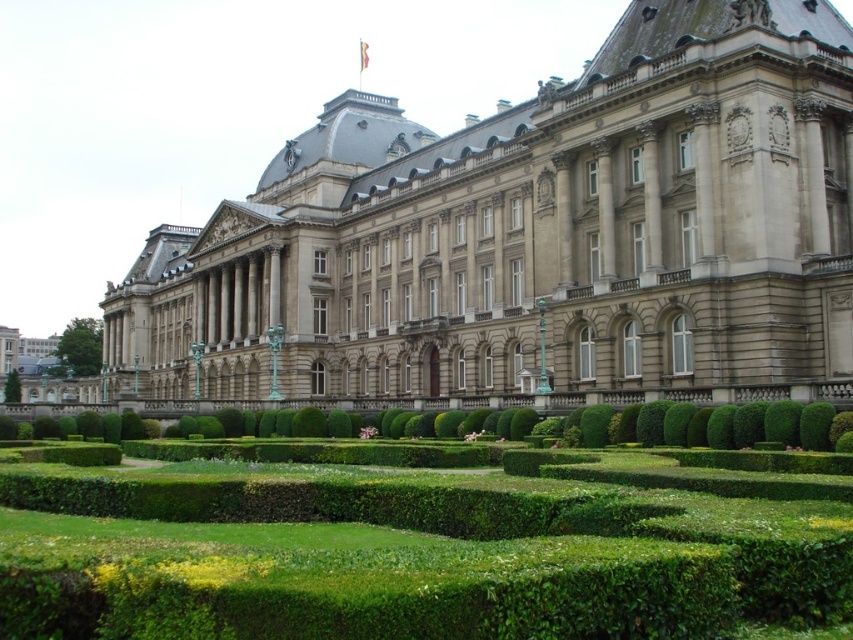
Who is positioned more to the right, smooth stone palace at center or green leafy hedge at center?

Positioned to the right is green leafy hedge at center.

Is smooth stone palace at center closer to the viewer compared to green leafy hedge at center?

No, it is not.

Is point (148, 392) positioned before point (770, 481)?

That is False.

Identify the location of smooth stone palace at center. The image size is (853, 640). (532, 234).